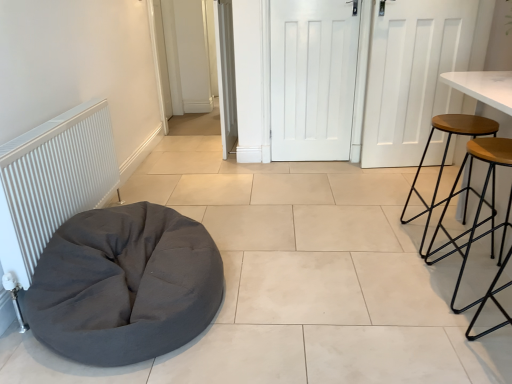
Locate an element on the screen. vacant space underneath wooden seat stool at right, acting as the second stool starting from the back (from a real-world perspective) is located at coordinates (472, 284).